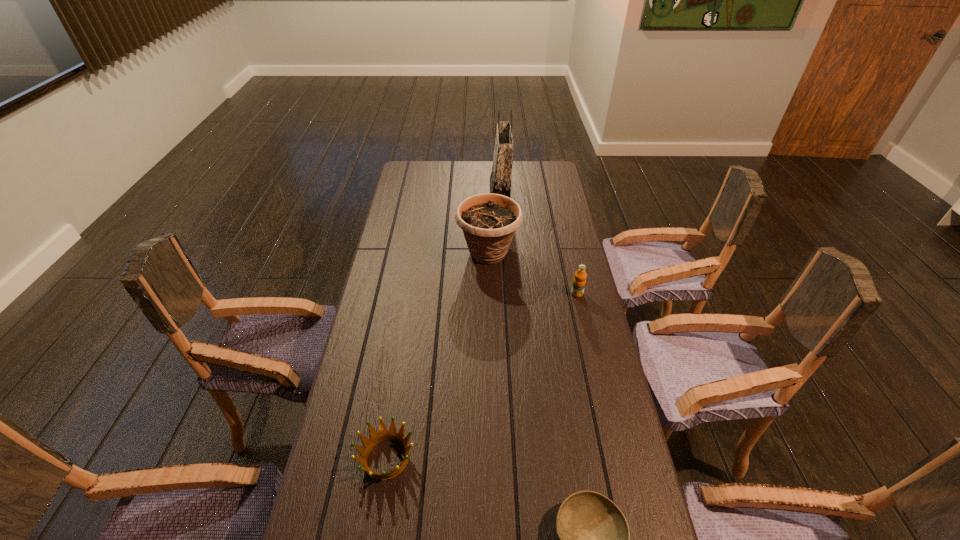
I want to click on free location located 0.210m on the front of the shopping bag with the design, so click(444, 192).

At what (x,y) coordinates should I click in order to perform the action: click on blank space located on the front of the second farthest object. Please return your answer as a coordinate pair (x, y). This screenshot has height=540, width=960. Looking at the image, I should click on (490, 322).

This screenshot has width=960, height=540. What are the coordinates of `free space located 0.250m on the label of the orange juice` in the screenshot? It's located at (591, 357).

Find the location of a particular element. This screenshot has height=540, width=960. free space located on the back of the crown is located at coordinates (408, 322).

You are a GUI agent. You are given a task and a screenshot of the screen. Output one action in this format:
    pyautogui.click(x=<x>, y=<y>)
    Task: Click on the object positioned at the far edge
    The width and height of the screenshot is (960, 540).
    Given the screenshot: What is the action you would take?
    pyautogui.click(x=500, y=179)

At what (x,y) coordinates should I click in order to perform the action: click on object present at the left edge. Please return your answer as a coordinate pair (x, y). This screenshot has height=540, width=960. Looking at the image, I should click on (375, 438).

Find the location of `object at the right edge`. object at the right edge is located at coordinates (579, 281).

At what (x,y) coordinates should I click in order to perform the action: click on free space at the left edge. Please return your answer as a coordinate pair (x, y). The image size is (960, 540). Looking at the image, I should click on (402, 274).

I want to click on vacant space at the right edge, so click(612, 429).

In the image, there is a desktop. Identify the location of blank space at the far left corner. (432, 186).